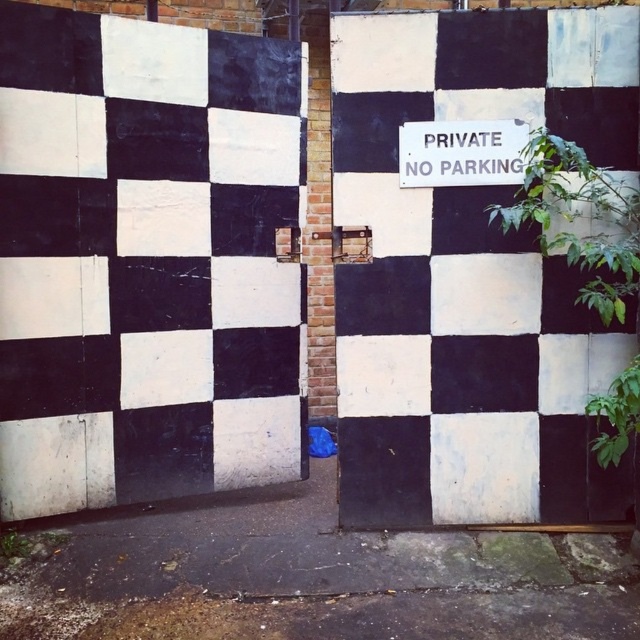
Does black painted wood door at center have a greater height compared to white plastic sign at upper center?

Yes.

Can you confirm if black painted wood door at center is positioned to the left of white plastic sign at upper center?

Incorrect, black painted wood door at center is not on the left side of white plastic sign at upper center.

Locate an element on the screen. The image size is (640, 640). black painted wood door at center is located at coordinates (472, 273).